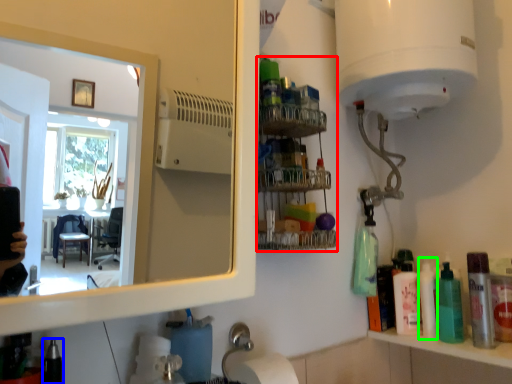
Question: Considering the real-world distances, which object is closest to shelf (highlighted by a red box)? toiletry (highlighted by a blue box) or cleaning product (highlighted by a green box).

Choices:
 (A) toiletry
 (B) cleaning product

Answer: (B)